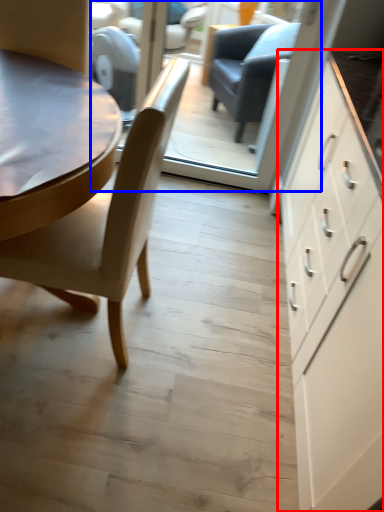
Question: Which object appears farthest to the camera in this image, cabinetry (highlighted by a red box) or glass door (highlighted by a blue box)?

Choices:
 (A) cabinetry
 (B) glass door

Answer: (B)